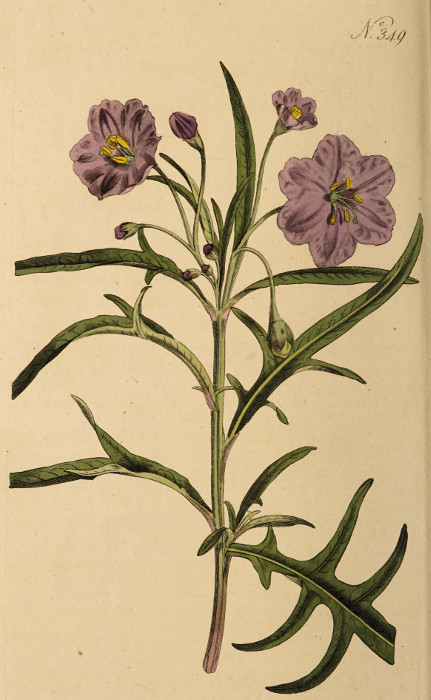
Locate an element on the screen. This screenshot has height=700, width=431. bottom of plant is located at coordinates (204, 670).